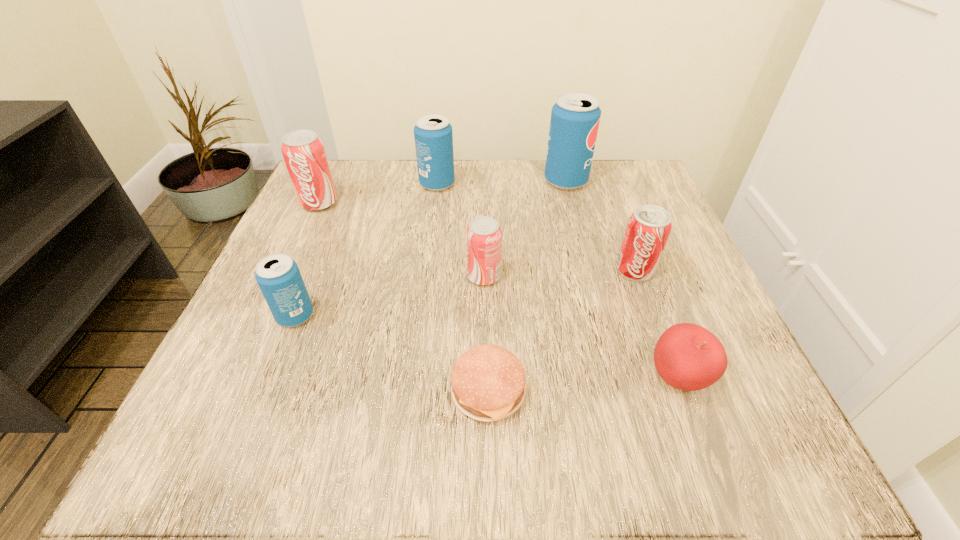
Image resolution: width=960 pixels, height=540 pixels. I want to click on red apple, so click(x=687, y=356).

Where is `apple`? This screenshot has width=960, height=540. apple is located at coordinates (687, 356).

Where is `hamburger`? Image resolution: width=960 pixels, height=540 pixels. hamburger is located at coordinates (488, 382).

You are a GUI agent. You are given a task and a screenshot of the screen. Output one action in this format:
    pyautogui.click(x=<x>, y=<y>)
    Task: Click on the free region located on the left of the tallest soda can
    
    Given the screenshot: What is the action you would take?
    pyautogui.click(x=450, y=181)

Where is `vacant space located 0.060m on the right of the second smallest blue soda can`? vacant space located 0.060m on the right of the second smallest blue soda can is located at coordinates (481, 184).

Identify the location of vacant area located on the logo side of the farthest red soda can. (280, 288).

Locate an element on the screen. free spot located 0.160m on the left of the rightmost red soda can is located at coordinates (529, 270).

Identify the location of free point located 0.120m on the logo side of the second red soda can from right to left. Image resolution: width=960 pixels, height=540 pixels. (401, 276).

The image size is (960, 540). What are the coordinates of `vacant space located 0.370m on the logo side of the second red soda can from right to left` in the screenshot? It's located at (263, 276).

I want to click on vacant region located 0.380m on the logo side of the second red soda can from right to left, so click(x=257, y=276).